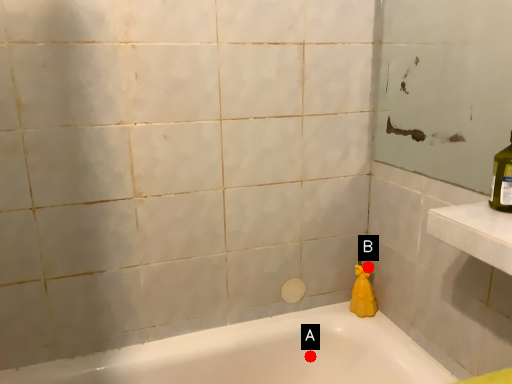
Question: Two points are circled on the image, labeled by A and B beside each circle. Which point appears closest to the camera in this image?

Choices:
 (A) A is closer
 (B) B is closer

Answer: (A)